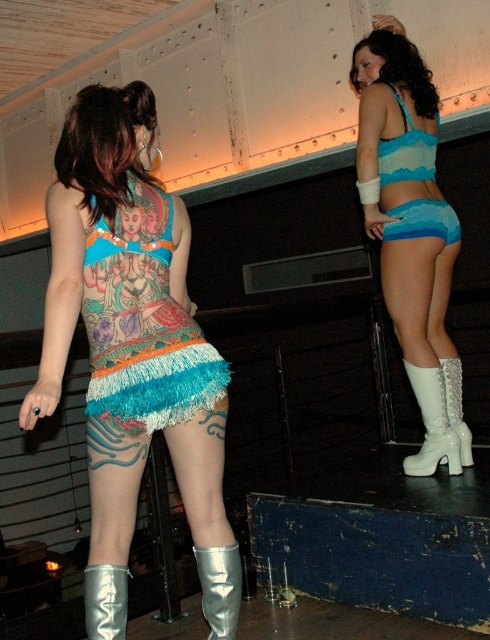
You are a costume designer preparing for a performance. You have two costume pieces to place on a mannequin for a stage show. The matte blue fabric bikini top at upper right and the blue fabric shorts at right. Given their sizes, which piece should you place first to ensure proper positioning on the mannequin?

The matte blue fabric bikini top at upper right should be placed first because it is larger in size than the blue fabric shorts at right, allowing for easier adjustments and proper alignment on the mannequin.

You are a photographer positioned at the back of the stage. You need to capture a shot where both the shiny silver boots at center and the turquoise fringe skirt at lower center are clearly visible. Considering their heights, which object will appear taller in your photo?

The shiny silver boots at center will appear taller in the photo since they have a greater height compared to the turquoise fringe skirt at lower center according to the description.

You are a photographer at the venue and need to adjust the lighting to highlight both the matte blue fabric bikini top at upper right and the blue fabric shorts at right. Since the bikini top is below the shorts, where should you position the light to ensure both are illuminated adequately?

The matte blue fabric bikini top at upper right is below the blue fabric shorts at right. To illuminate both adequately, position the light above the shorts so that it can cast light downward onto both the shorts and the bikini top.